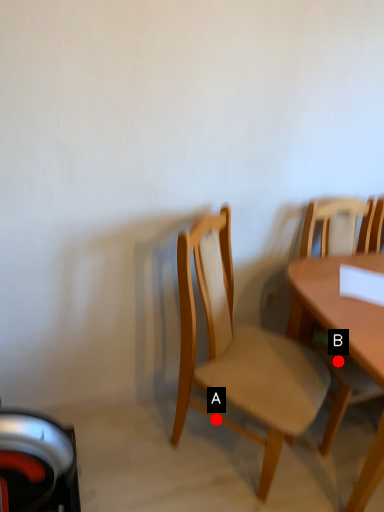
Question: Two points are circled on the image, labeled by A and B beside each circle. Which point is farther from the camera taking this photo?

Choices:
 (A) A is further
 (B) B is further

Answer: (B)